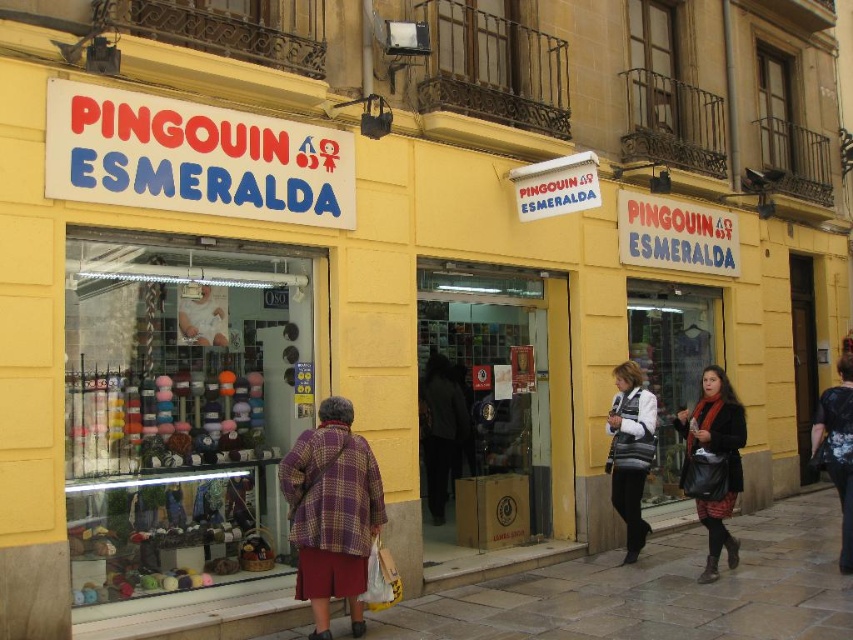
Is point (93, 428) positioned behind point (337, 472)?

Yes, it is behind point (337, 472).

Is point (170, 444) behind point (364, 460)?

That is True.

Where is `multicolored yarns at left`? The height and width of the screenshot is (640, 853). multicolored yarns at left is located at coordinates (180, 410).

Consider the image. Which is more to the right, multicolored yarns at left or clear glass door at center?

Positioned to the right is clear glass door at center.

Looking at this image, does multicolored yarns at left have a greater height compared to clear glass door at center?

No.

Where is `multicolored yarns at left`? The image size is (853, 640). multicolored yarns at left is located at coordinates (180, 410).

Which of these two, clear glass door at center or transparent glass shop window at center, stands shorter?

transparent glass shop window at center

Which is in front, point (544, 380) or point (646, 380)?

Point (544, 380)

Measure the distance between point (572, 493) and camera.

They are 8.94 meters apart.

This screenshot has height=640, width=853. In order to click on clear glass door at center in this screenshot , I will do `click(498, 403)`.